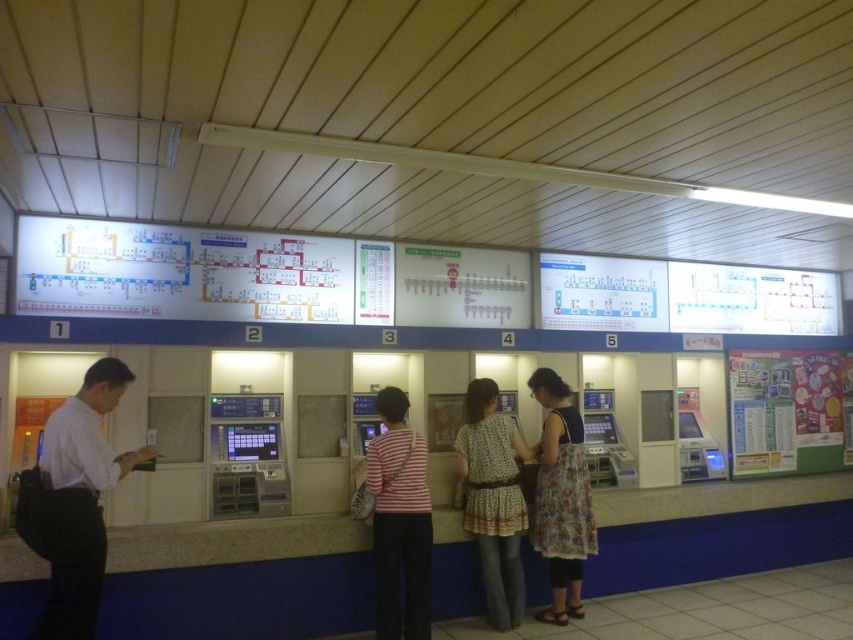
You are a traveler standing in the ticketing area and notice two people in front of you. One is wearing a white shirt at left and the other a dotted fabric blouse at center. Which person is closer to the ticket machines?

The white shirt at left is positioned over the dotted fabric blouse at center, meaning the person in the white shirt at left is closer to the ticket machines.

You are a traveler standing in the ticketing area and need to choose between the striped cotton shirt at center and the floral dress at center. Which one takes up less space in your luggage?

The striped cotton shirt at center occupies less space than the floral dress at center, so it would take up less space in your luggage.

You are a traveler at the train station and you see a person wearing a white shirt at left and another wearing a floral dress at center. Which person is closer to you?

The white shirt at left is closer to you because it is in front of the floral dress at center.